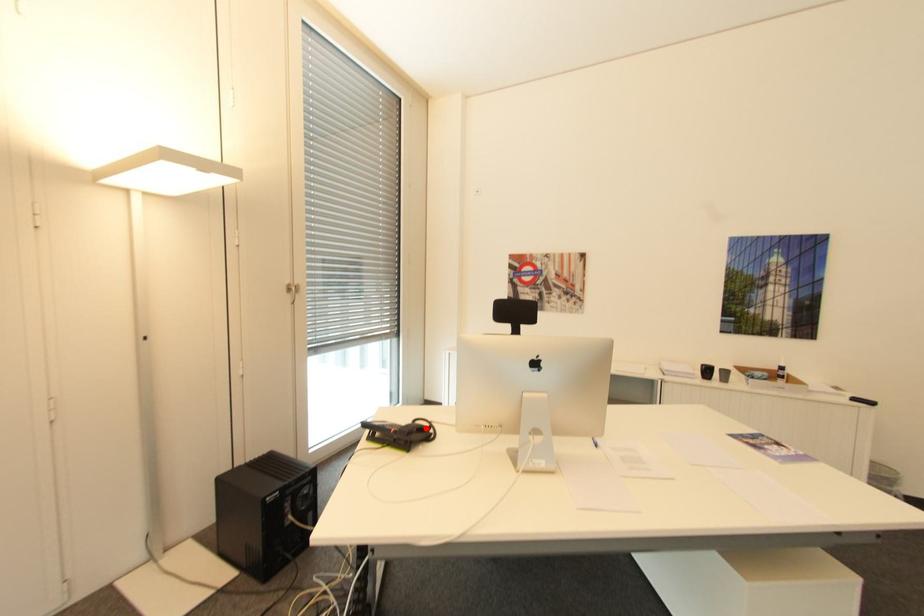
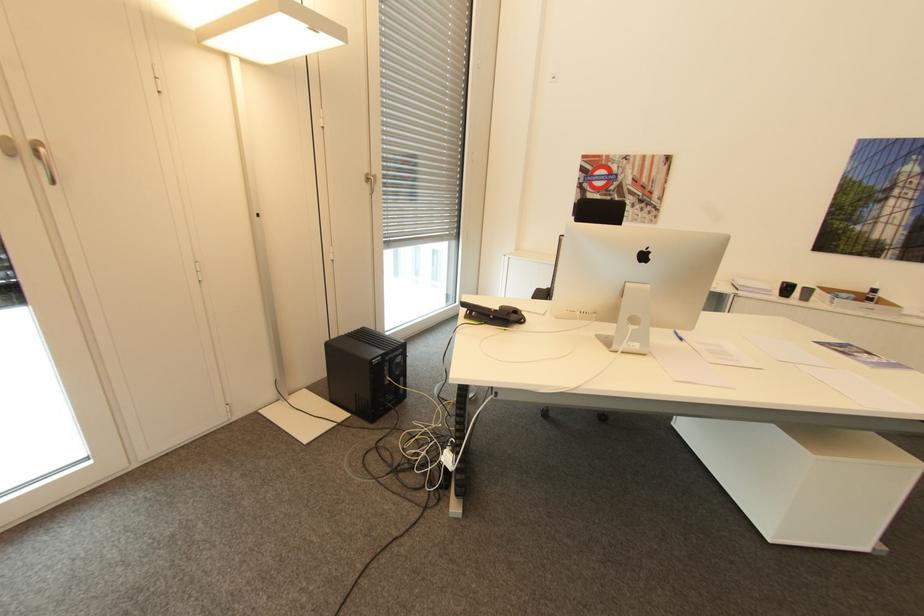
Locate, in the second image, the point that corresponds to the highlighted location in the first image.

(520, 310)